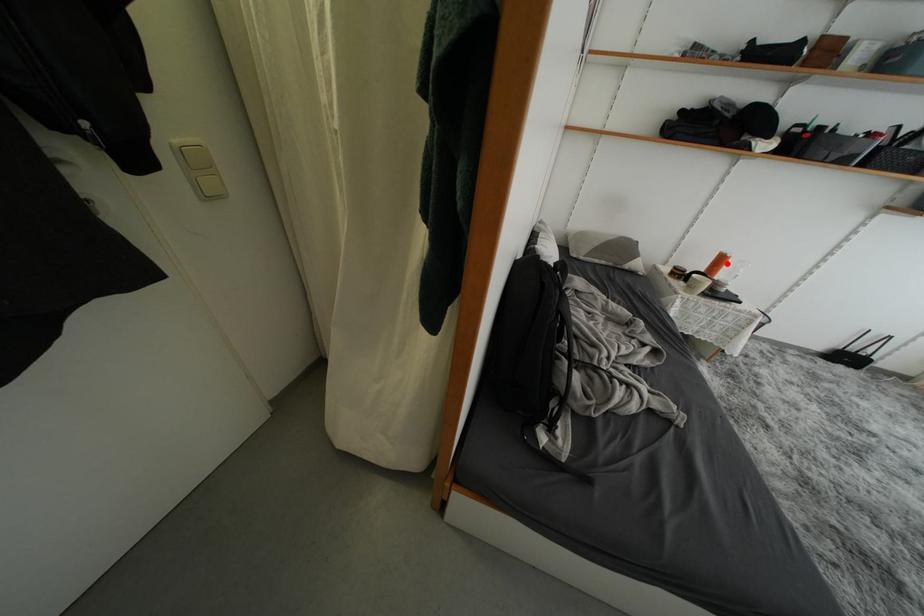
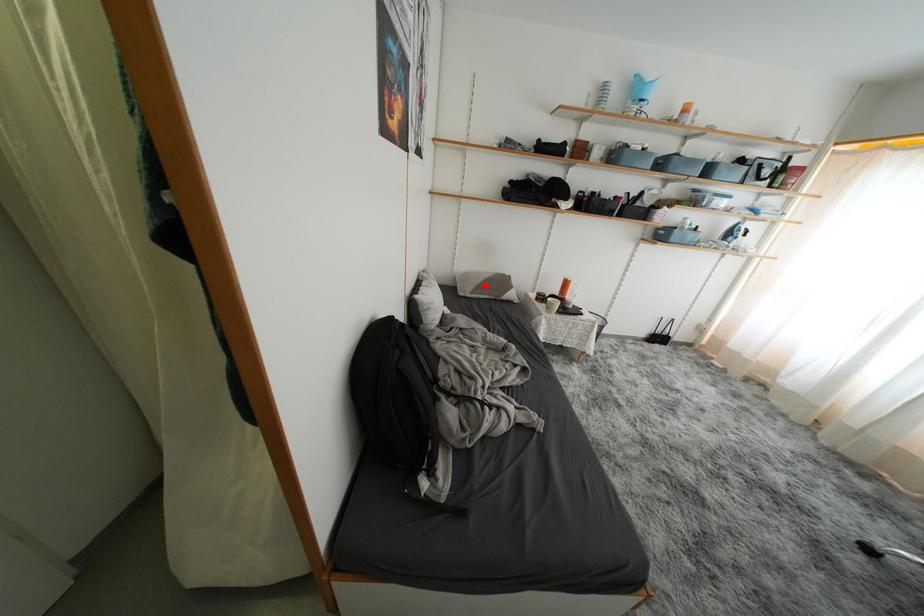
Consider the image. I am providing you with two images of the same scene from different viewpoints. A red point is marked on the first image and another point is marked on the second image. Is the marked point in image1 the same physical position as the marked point in image2?

No